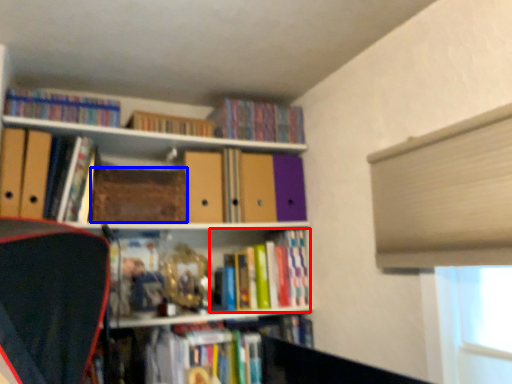
Question: Which object appears farthest to the camera in this image, book (highlighted by a red box) or paperback book (highlighted by a blue box)?

Choices:
 (A) book
 (B) paperback book

Answer: (A)